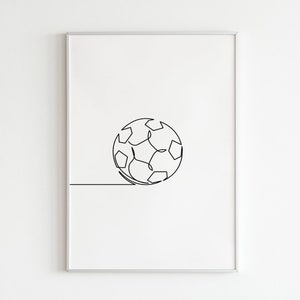
You are a GUI agent. You are given a task and a screenshot of the screen. Output one action in this format:
    pyautogui.click(x=<x>, y=<y>)
    Task: Click on the frame
    Image resolution: width=300 pixels, height=300 pixels.
    Given the screenshot: What is the action you would take?
    pyautogui.click(x=66, y=64), pyautogui.click(x=142, y=31), pyautogui.click(x=237, y=116), pyautogui.click(x=157, y=268)